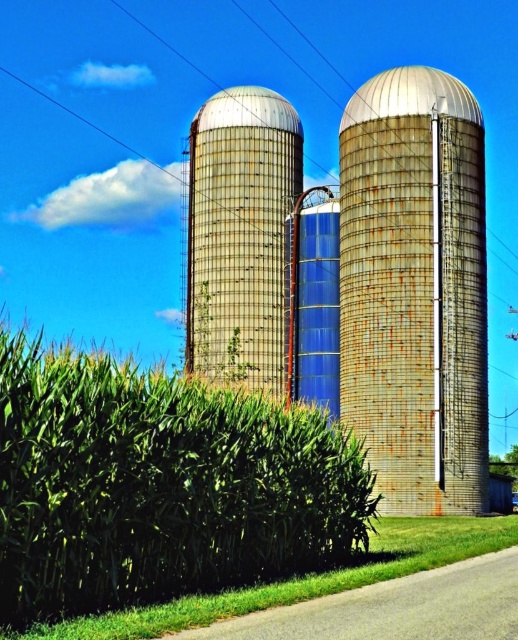
Question: Considering the real-world distances, which object is farthest from the green leafy corn at center?

Choices:
 (A) rusty metal silo at center
 (B) rusty metallic silo at center

Answer: (B)

Question: Does green leafy corn at center appear on the left side of rusty metallic silo at center?

Choices:
 (A) no
 (B) yes

Answer: (A)

Question: Is the position of rusty metal silo at center less distant than that of rusty metallic silo at center?

Choices:
 (A) yes
 (B) no

Answer: (A)

Question: Among these objects, which one is nearest to the camera?

Choices:
 (A) rusty metallic silo at center
 (B) rusty metal silo at center
 (C) green leafy corn at center

Answer: (C)

Question: Considering the real-world distances, which object is farthest from the rusty metallic silo at center?

Choices:
 (A) green leafy corn at center
 (B) rusty metal silo at center

Answer: (A)

Question: Does rusty metal silo at center appear over rusty metallic silo at center?

Choices:
 (A) no
 (B) yes

Answer: (A)